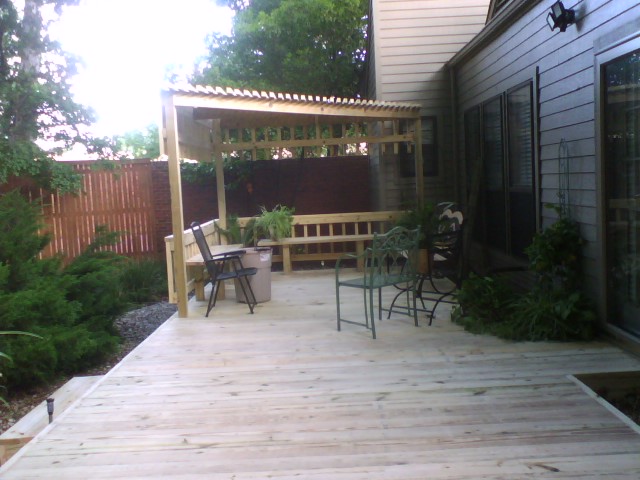
Locate an element on the screen. black metallic chairs is located at coordinates (221, 275), (448, 264).